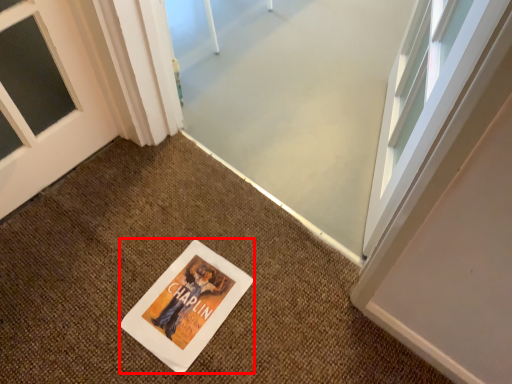
Question: From the image's perspective, where is flyer (annotated by the red box) located relative to doormat?

Choices:
 (A) above
 (B) below

Answer: (A)